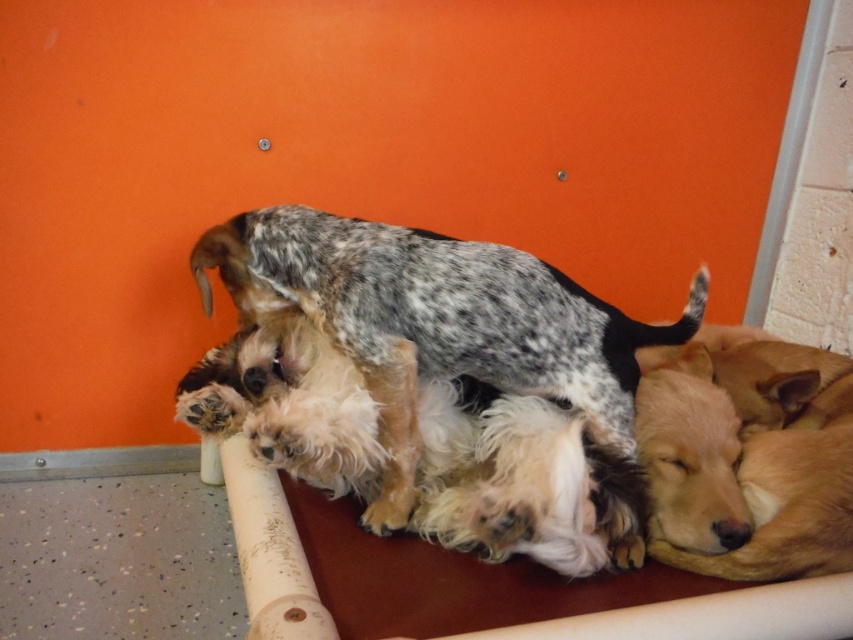
Does speckled fur dog at center come behind golden fur dog at lower right?

Yes, it is behind golden fur dog at lower right.

Between speckled fur dog at center and golden fur dog at lower right, which one is positioned higher?

Positioned higher is speckled fur dog at center.

Locate an element on the screen. speckled fur dog at center is located at coordinates (436, 321).